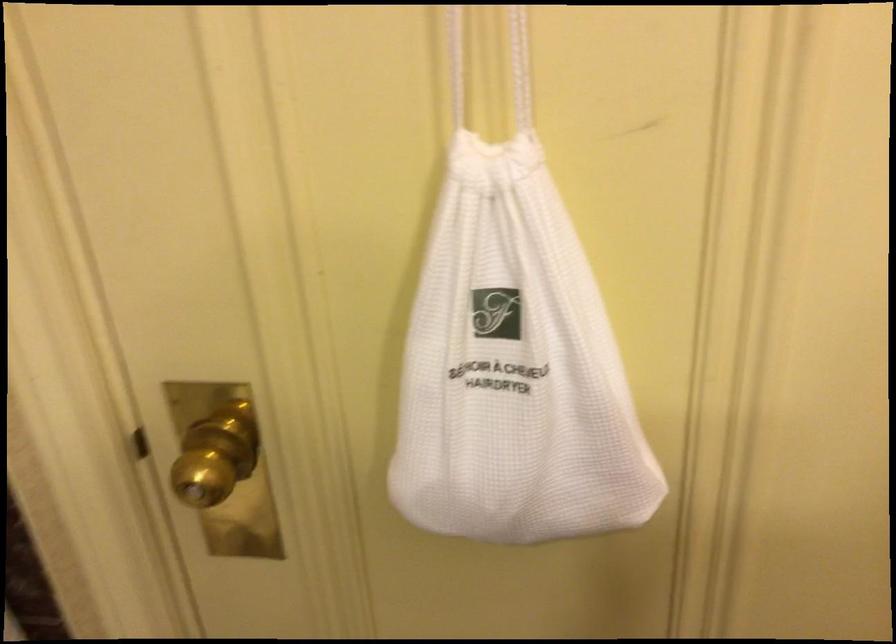
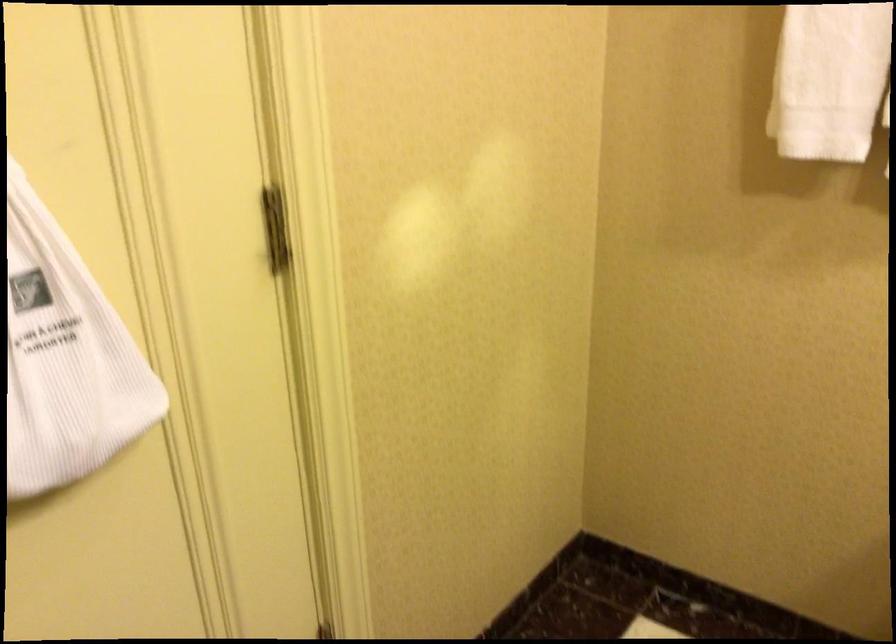
The point at (548,402) is marked in the first image. Where is the corresponding point in the second image?

(65, 357)